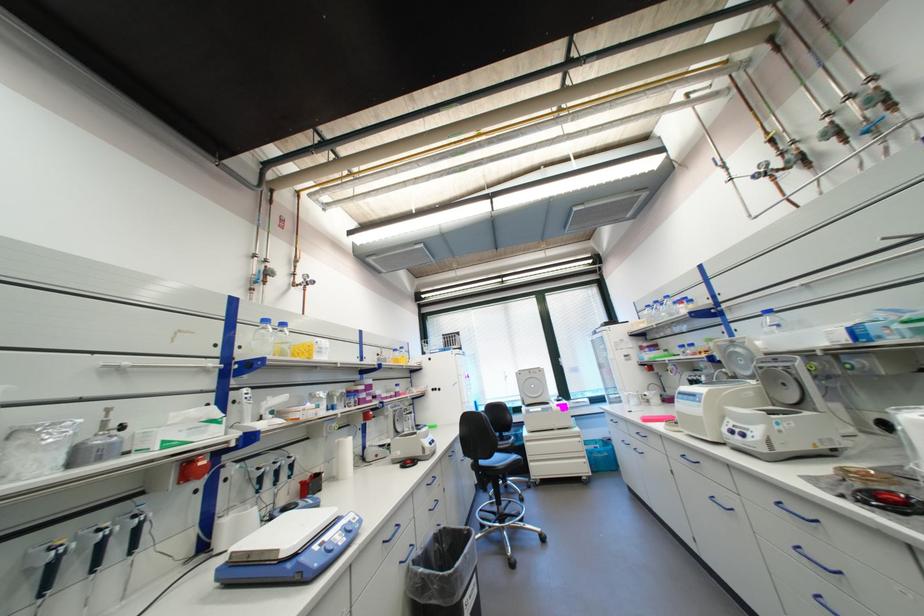
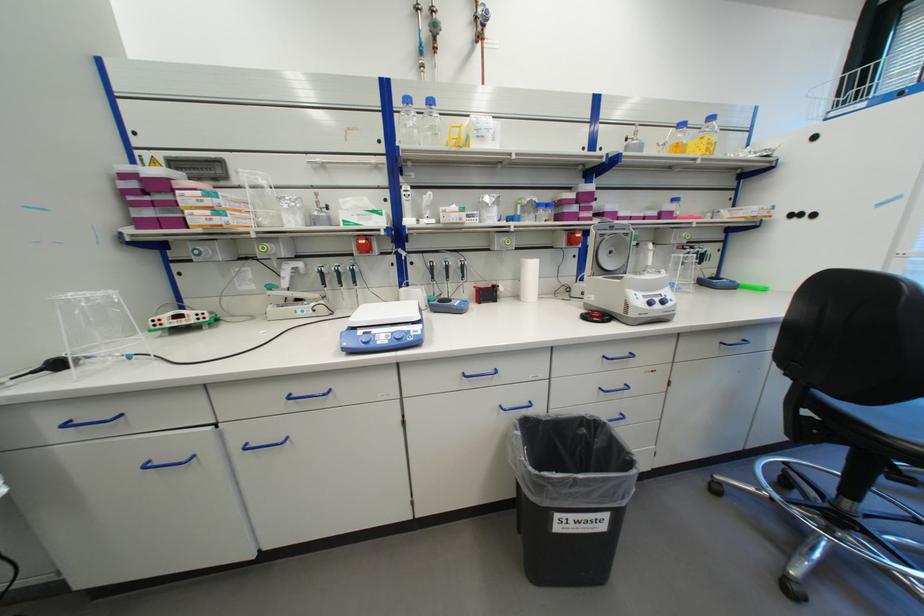
Find the pixel in the second image that matches point (359, 537) in the first image.

(405, 344)